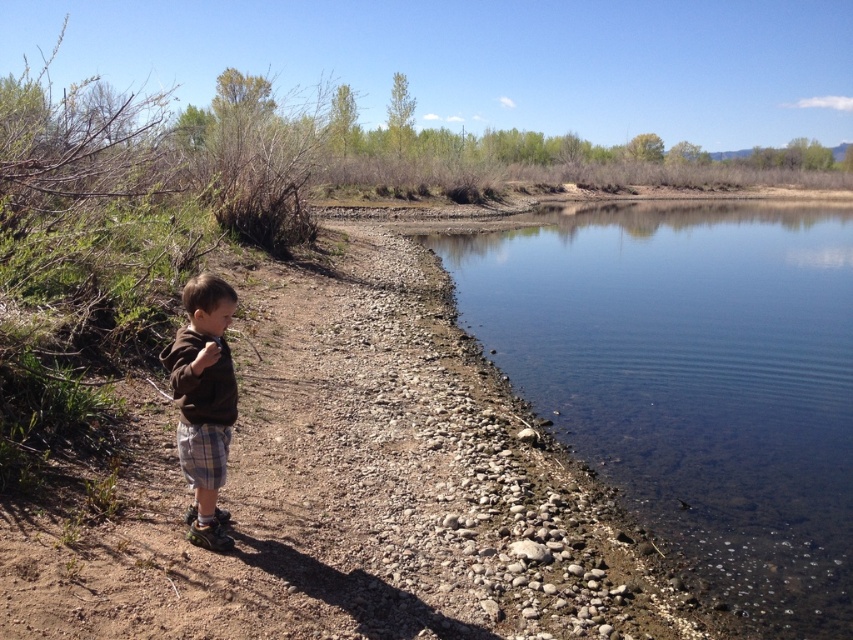
Question: Can you confirm if brown dirt path at center is positioned above brown cotton shirt at left?

Choices:
 (A) no
 (B) yes

Answer: (B)

Question: Can you confirm if clear water at river right is positioned to the right of brown cotton shirt at left?

Choices:
 (A) yes
 (B) no

Answer: (A)

Question: Which object is farther from the camera taking this photo?

Choices:
 (A) brown dirt path at center
 (B) brown cotton shirt at left
 (C) clear water at river right

Answer: (C)

Question: Which point is closer to the camera?

Choices:
 (A) (181, 392)
 (B) (86, 632)

Answer: (B)

Question: Which object is farther from the camera taking this photo?

Choices:
 (A) brown cotton shirt at left
 (B) clear water at river right

Answer: (B)

Question: Can you confirm if brown dirt path at center is positioned above clear water at river right?

Choices:
 (A) yes
 (B) no

Answer: (B)